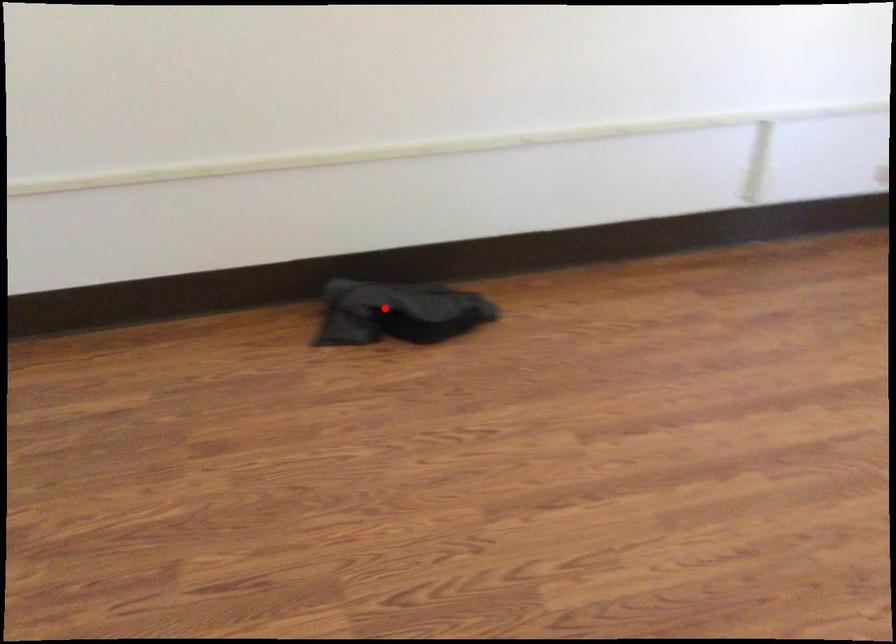
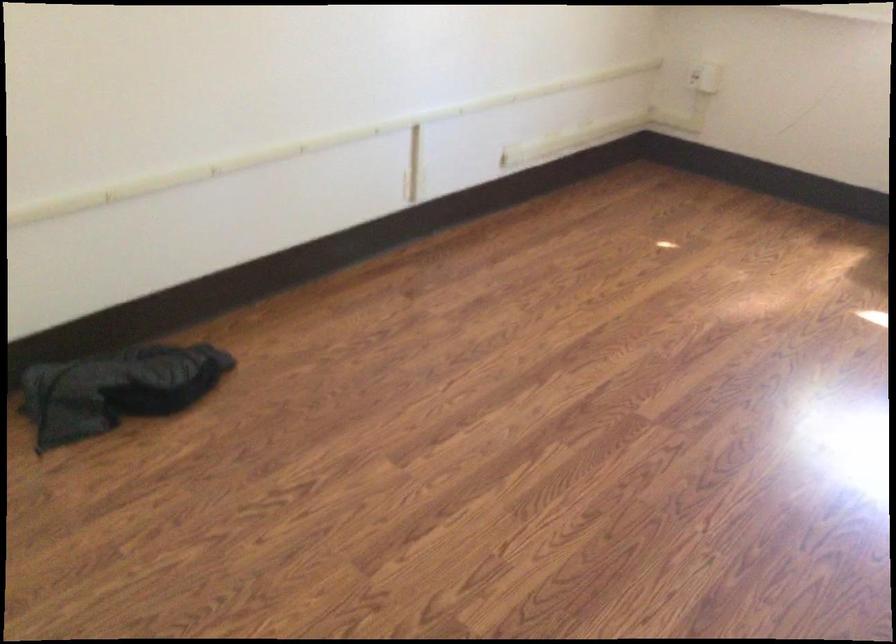
The point at the highlighted location is marked in the first image. Where is the corresponding point in the second image?

(116, 389)